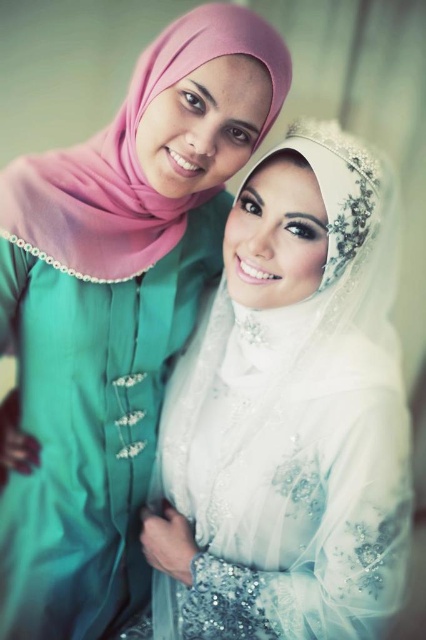
You are a photographer at a wedding and need to adjust the lighting to ensure both the satin white veil at center and the white sheer veil at upper center are clearly visible. Which veil is closer to the camera?

The satin white veil at center is positioned under the white sheer veil at upper center, meaning the white sheer veil at upper center is closer to the camera and will require more focused lighting to ensure both are visible.

In the scene, there are two head coverings worn by the women. The first is the satin white veil at center, and the second is the matte pink hijab at upper left. Which of these two items is positioned to the right side of the other?

The satin white veil at center is to the right of the matte pink hijab at upper left.

You are a photographer setting up for a group photo. You need to ensure that both the satin white veil at center and the matte pink hijab at upper left are fully visible in the frame. Based on their sizes, which one requires more space horizontally to capture its full width?

The matte pink hijab at upper left requires more space horizontally because its width is greater than the satin white veil at center.